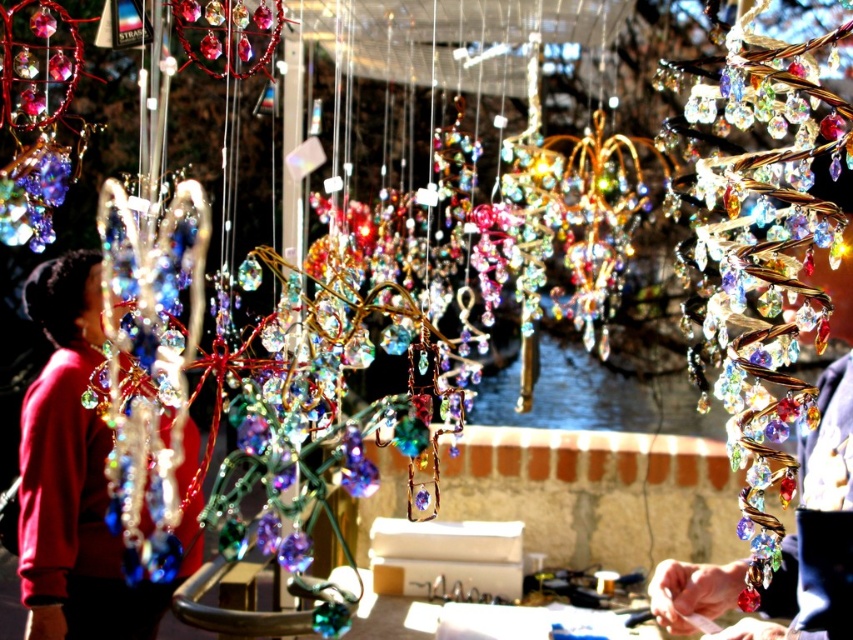
Consider the image. You are standing at the entrance of the market stall and see two points in the image. The first point is at coordinates point (813, 387) and the second is at point (33, 577). Which point is closer to you?

Point (813, 387) is in front of point (33, 577), so the first point is closer to you.

You are a customer at the market and see the multicolored glass ornaments at center and the matte red sweater at left. Which item is positioned higher in the image?

The multicolored glass ornaments at center is positioned higher than the matte red sweater at left according to the description.